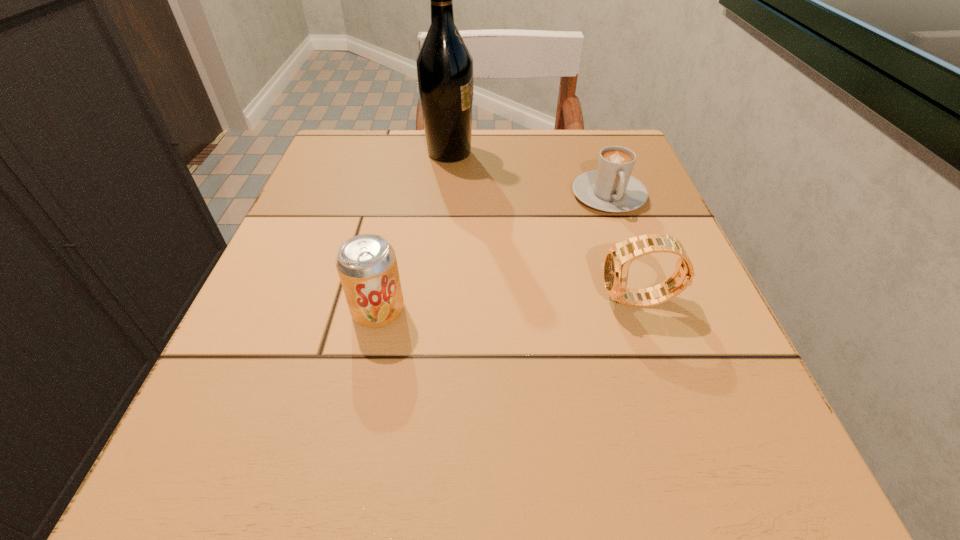
What are the coordinates of `the tallest object` in the screenshot? It's located at (444, 64).

Locate an element on the screen. The width and height of the screenshot is (960, 540). the farthest object is located at coordinates (444, 64).

The image size is (960, 540). In order to click on pop (soda) in this screenshot , I will do `click(367, 266)`.

At what (x,y) coordinates should I click in order to perform the action: click on watch. Please return your answer as a coordinate pair (x, y). This screenshot has height=540, width=960. Looking at the image, I should click on (618, 259).

You are a GUI agent. You are given a task and a screenshot of the screen. Output one action in this format:
    pyautogui.click(x=<x>, y=<y>)
    Task: Click on the cappuccino
    
    Given the screenshot: What is the action you would take?
    pyautogui.click(x=611, y=188)

This screenshot has width=960, height=540. I want to click on the shortest object, so click(x=611, y=188).

What are the coordinates of `vacant space located 0.130m on the label of the farthest object` in the screenshot? It's located at coord(535,153).

Identify the location of vacant area located 0.330m on the right of the pop (soda). (634, 310).

I want to click on free location located 0.220m on the face of the watch, so click(452, 301).

At what (x,y) coordinates should I click in order to perform the action: click on vacant space situated 0.310m on the face of the watch. Please return your answer as a coordinate pair (x, y). The height and width of the screenshot is (540, 960). Looking at the image, I should click on (391, 301).